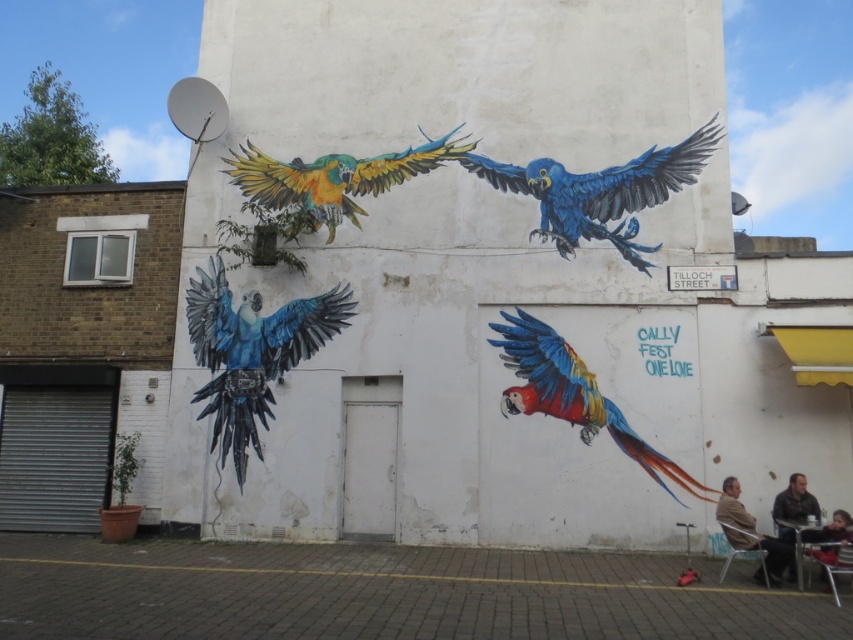
Is blue glossy parrot at center positioned before brown leather jacket at lower right?

That is False.

Measure the distance between blue glossy parrot at center and camera.

blue glossy parrot at center is 9.86 meters from camera.

This screenshot has width=853, height=640. I want to click on blue glossy parrot at center, so click(251, 353).

Is point (604, 401) farther from camera compared to point (792, 566)?

Yes, it is.

Is shiny multicolored parrot at center bigger than leather jacket at lower right?

Indeed, shiny multicolored parrot at center has a larger size compared to leather jacket at lower right.

This screenshot has width=853, height=640. What are the coordinates of `shiny multicolored parrot at center` in the screenshot? It's located at (573, 396).

The height and width of the screenshot is (640, 853). I want to click on shiny multicolored parrot at center, so click(573, 396).

Is point (558, 380) farther from camera compared to point (734, 531)?

Yes, it is.

At what (x,y) coordinates should I click in order to perform the action: click on shiny multicolored parrot at center. Please return your answer as a coordinate pair (x, y). This screenshot has width=853, height=640. Looking at the image, I should click on (573, 396).